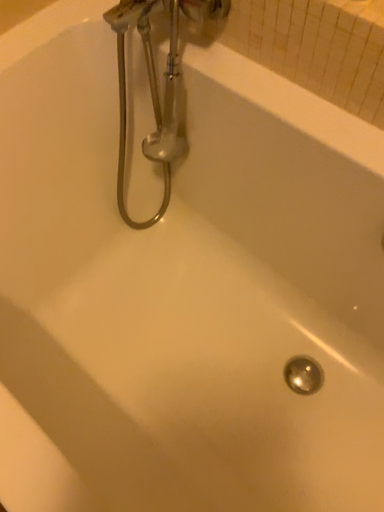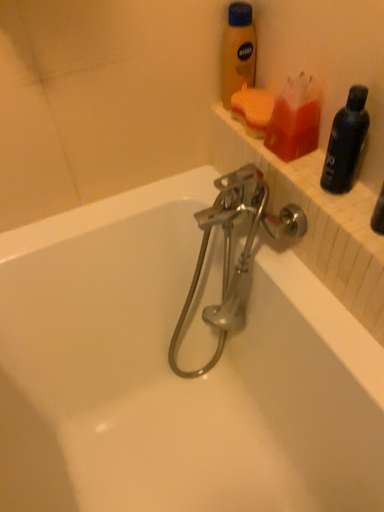
Question: Which way did the camera rotate in the video?

Choices:
 (A) rotated downward
 (B) rotated upward

Answer: (B)